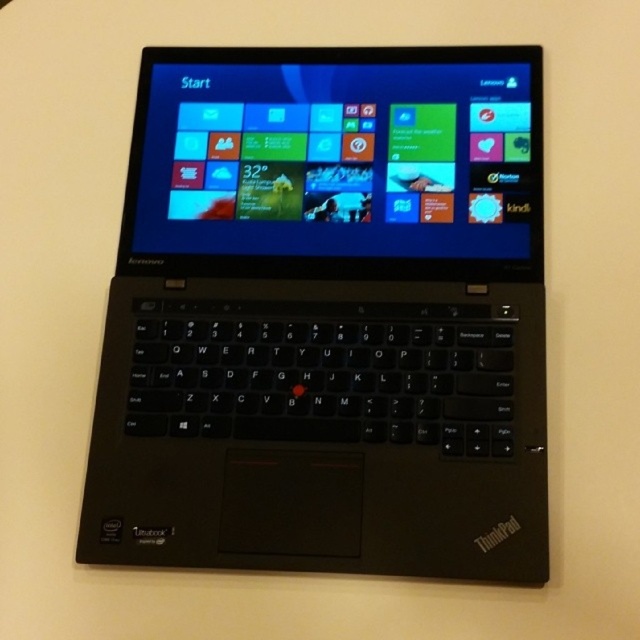
You are trying to locate a specific point in the image. The point is at coordinates (326,317). Based on the scene description, where would this point be located?

The point at coordinates (326,317) is located on the black matte ThinkPad at center.